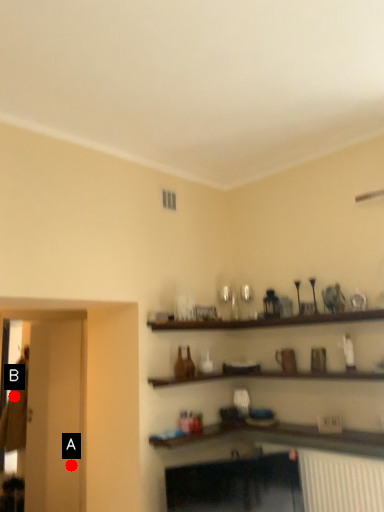
Question: Two points are circled on the image, labeled by A and B beside each circle. Which point is farther from the camera taking this photo?

Choices:
 (A) A is further
 (B) B is further

Answer: (B)